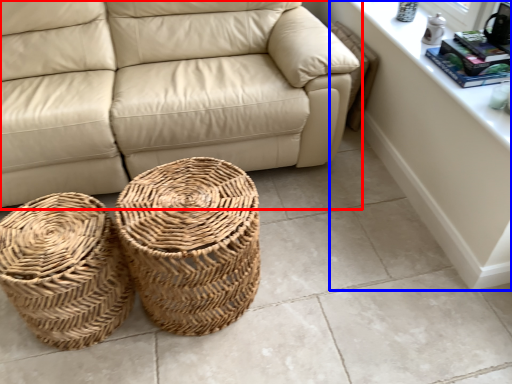
Question: Which object appears closest to the camera in this image, studio couch (highlighted by a red box) or dresser (highlighted by a blue box)?

Choices:
 (A) studio couch
 (B) dresser

Answer: (B)